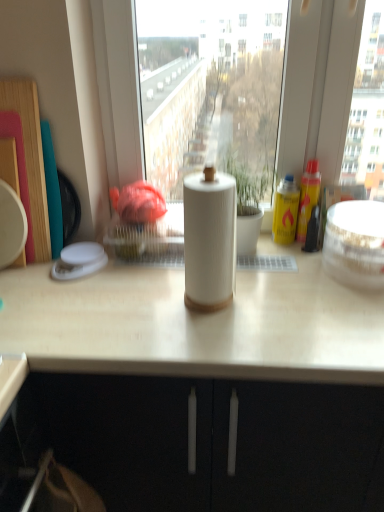
This screenshot has width=384, height=512. I want to click on free location to the right of white plastic container at left, the first appliance viewed from the left, so click(141, 276).